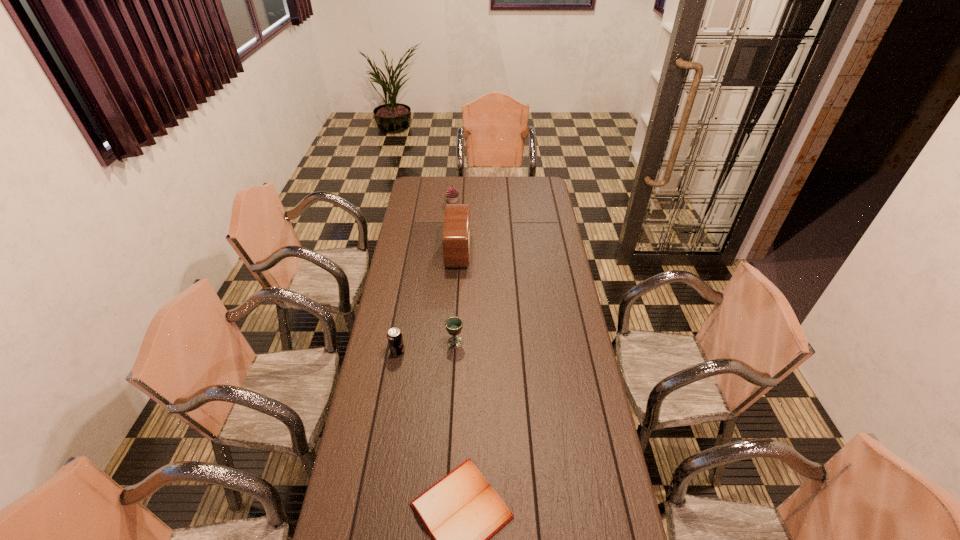
You are a GUI agent. You are given a task and a screenshot of the screen. Output one action in this format:
    pyautogui.click(x=<x>, y=<y>)
    Task: Click on the second farthest object
    Image resolution: width=960 pixels, height=540 pixels.
    Given the screenshot: What is the action you would take?
    pyautogui.click(x=456, y=231)

Where is `the tallest object`? The height and width of the screenshot is (540, 960). the tallest object is located at coordinates (456, 231).

You are a GUI agent. You are given a task and a screenshot of the screen. Output one action in this format:
    pyautogui.click(x=<x>, y=<y>)
    Task: Click on the soda can
    Image resolution: width=960 pixels, height=540 pixels.
    Given the screenshot: What is the action you would take?
    pyautogui.click(x=395, y=339)

Locate an element on the screen. The width and height of the screenshot is (960, 540). chalice is located at coordinates (454, 325).

Identify the location of cupcake. Image resolution: width=960 pixels, height=540 pixels. (452, 194).

Where is `free space located on the front-facing side of the second farthest object`? This screenshot has width=960, height=540. free space located on the front-facing side of the second farthest object is located at coordinates (509, 252).

Locate an element on the screen. The height and width of the screenshot is (540, 960). free space located 0.340m on the right of the leftmost object is located at coordinates (486, 352).

This screenshot has width=960, height=540. Find the location of `vacant point located on the right of the chalice`. vacant point located on the right of the chalice is located at coordinates (482, 342).

Locate an element on the screen. vacant position located 0.150m on the right of the cupcake is located at coordinates (484, 201).

Identify the location of object that is at the left edge. (395, 339).